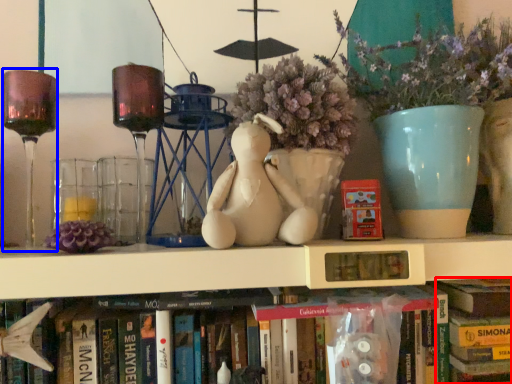
Question: Which object is further to the camera taking this photo, book (highlighted by a red box) or wine glass (highlighted by a blue box)?

Choices:
 (A) book
 (B) wine glass

Answer: (A)